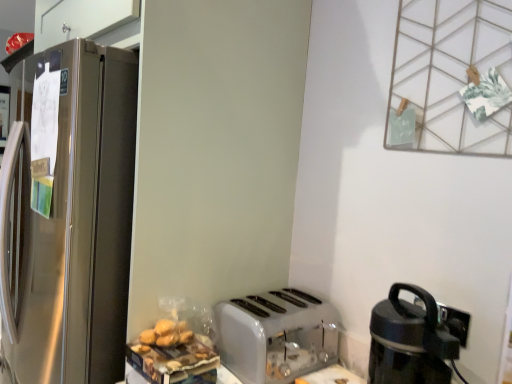
What are the coordinates of `black plastic coffee maker at lower right` in the screenshot? It's located at click(410, 341).

What do you see at coordinates (410, 341) in the screenshot? I see `black plastic coffee maker at lower right` at bounding box center [410, 341].

At what (x,y) coordinates should I click in order to perform the action: click on white plastic toaster at lower center. Please return your answer as a coordinate pair (x, y). This screenshot has height=384, width=512. Looking at the image, I should click on (276, 335).

Image resolution: width=512 pixels, height=384 pixels. What do you see at coordinates (276, 335) in the screenshot?
I see `white plastic toaster at lower center` at bounding box center [276, 335].

The height and width of the screenshot is (384, 512). What are the coordinates of `black plastic coffee maker at lower right` in the screenshot? It's located at (410, 341).

Considering the relative positions of white plastic toaster at lower center and black plastic coffee maker at lower right in the image provided, is white plastic toaster at lower center to the left or to the right of black plastic coffee maker at lower right?

From the image, it's evident that white plastic toaster at lower center is to the left of black plastic coffee maker at lower right.

Considering the positions of objects white plastic toaster at lower center and black plastic coffee maker at lower right in the image provided, who is behind, white plastic toaster at lower center or black plastic coffee maker at lower right?

white plastic toaster at lower center is more distant.

Which is less distant, (297,336) or (421,381)?

The point (421,381) is more forward.

From the image's perspective, would you say white plastic toaster at lower center is shown under black plastic coffee maker at lower right?

Yes.

From a real-world perspective, which object stands above the other?

black plastic coffee maker at lower right.

Between white plastic toaster at lower center and black plastic coffee maker at lower right, which one has smaller width?

black plastic coffee maker at lower right is thinner.

Can you confirm if white plastic toaster at lower center is taller than black plastic coffee maker at lower right?

In fact, white plastic toaster at lower center may be shorter than black plastic coffee maker at lower right.

In terms of size, does white plastic toaster at lower center appear bigger or smaller than black plastic coffee maker at lower right?

Considering their sizes, white plastic toaster at lower center takes up more space than black plastic coffee maker at lower right.

Looking at this image, is white plastic toaster at lower center inside or outside of black plastic coffee maker at lower right?

white plastic toaster at lower center cannot be found inside black plastic coffee maker at lower right.

Would you consider white plastic toaster at lower center to be distant from black plastic coffee maker at lower right?

white plastic toaster at lower center is near black plastic coffee maker at lower right, not far away.

Is white plastic toaster at lower center looking in the opposite direction of black plastic coffee maker at lower right?

No.

How much distance is there between white plastic toaster at lower center and black plastic coffee maker at lower right?

white plastic toaster at lower center and black plastic coffee maker at lower right are 12.39 inches apart from each other.

What are the coordinates of `toaster on the left of black plastic coffee maker at lower right` in the screenshot? It's located at (276, 335).

Which is more to the left, black plastic coffee maker at lower right or white plastic toaster at lower center?

white plastic toaster at lower center.

Considering their positions, is black plastic coffee maker at lower right located in front of or behind white plastic toaster at lower center?

black plastic coffee maker at lower right is in front of white plastic toaster at lower center.

Does point (428, 343) appear closer or farther from the camera than point (291, 360)?

Point (428, 343) appears to be closer to the viewer than point (291, 360).

In the scene shown: From the image's perspective, between black plastic coffee maker at lower right and white plastic toaster at lower center, which one is located above?

black plastic coffee maker at lower right.

From a real-world perspective, is black plastic coffee maker at lower right on white plastic toaster at lower center?

Yes.

Looking at their sizes, would you say black plastic coffee maker at lower right is wider or thinner than white plastic toaster at lower center?

Considering their sizes, black plastic coffee maker at lower right looks slimmer than white plastic toaster at lower center.

Who is shorter, black plastic coffee maker at lower right or white plastic toaster at lower center?

white plastic toaster at lower center.

Considering the sizes of objects black plastic coffee maker at lower right and white plastic toaster at lower center in the image provided, who is smaller, black plastic coffee maker at lower right or white plastic toaster at lower center?

Smaller between the two is black plastic coffee maker at lower right.

Is white plastic toaster at lower center located within black plastic coffee maker at lower right?

Actually, white plastic toaster at lower center is outside black plastic coffee maker at lower right.

Is black plastic coffee maker at lower right far from white plastic toaster at lower center?

No.

Is black plastic coffee maker at lower right facing away from white plastic toaster at lower center?

No, black plastic coffee maker at lower right is not facing the opposite direction of white plastic toaster at lower center.

How different are the orientations of black plastic coffee maker at lower right and white plastic toaster at lower center in degrees?

There is a 89.2-degree angle between the facing directions of black plastic coffee maker at lower right and white plastic toaster at lower center.

Where is `toaster below the black plastic coffee maker at lower right (from a real-world perspective)`? toaster below the black plastic coffee maker at lower right (from a real-world perspective) is located at coordinates (276, 335).

Find the location of a particular element. This screenshot has height=384, width=512. kitchen appliance above the white plastic toaster at lower center (from the image's perspective) is located at coordinates (410, 341).

Locate an element on the screen. Image resolution: width=512 pixels, height=384 pixels. kitchen appliance above the white plastic toaster at lower center (from a real-world perspective) is located at coordinates (410, 341).